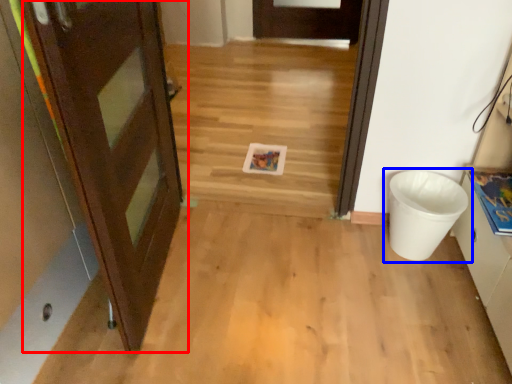
Question: Among these objects, which one is farthest to the camera, door (highlighted by a red box) or waste container (highlighted by a blue box)?

Choices:
 (A) door
 (B) waste container

Answer: (B)